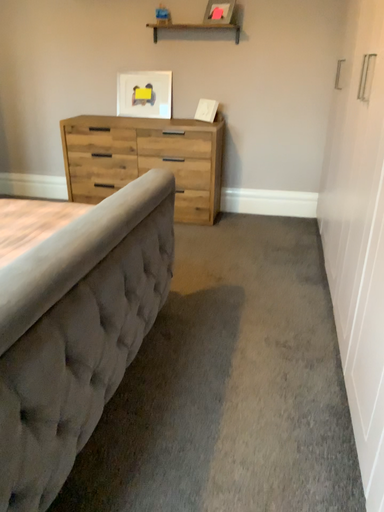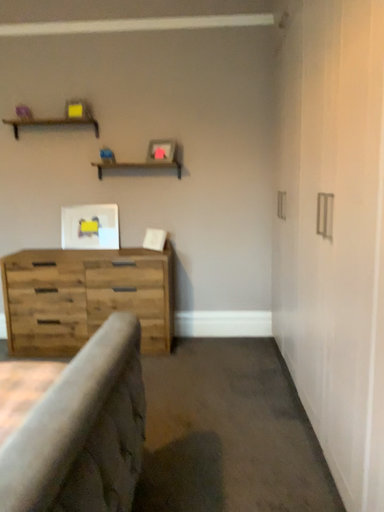
Question: Which way did the camera rotate in the video?

Choices:
 (A) rotated left
 (B) rotated right

Answer: (B)